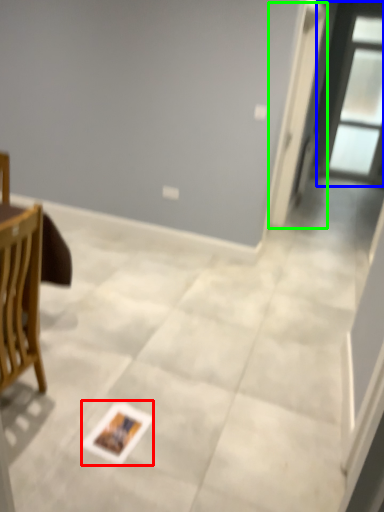
Question: Considering the real-world distances, which object is farthest from postcard (highlighted by a red box)? window (highlighted by a blue box) or screen door (highlighted by a green box)?

Choices:
 (A) window
 (B) screen door

Answer: (A)